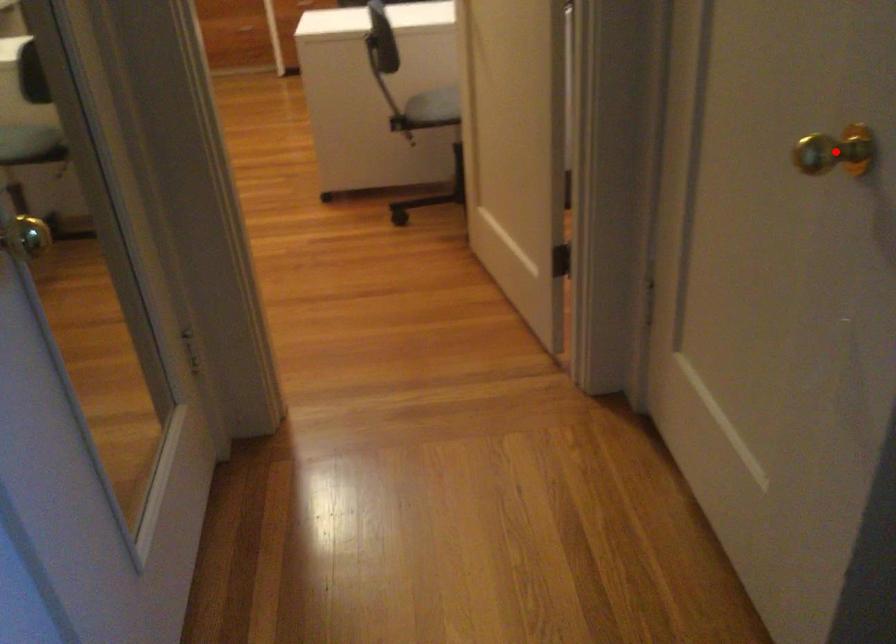
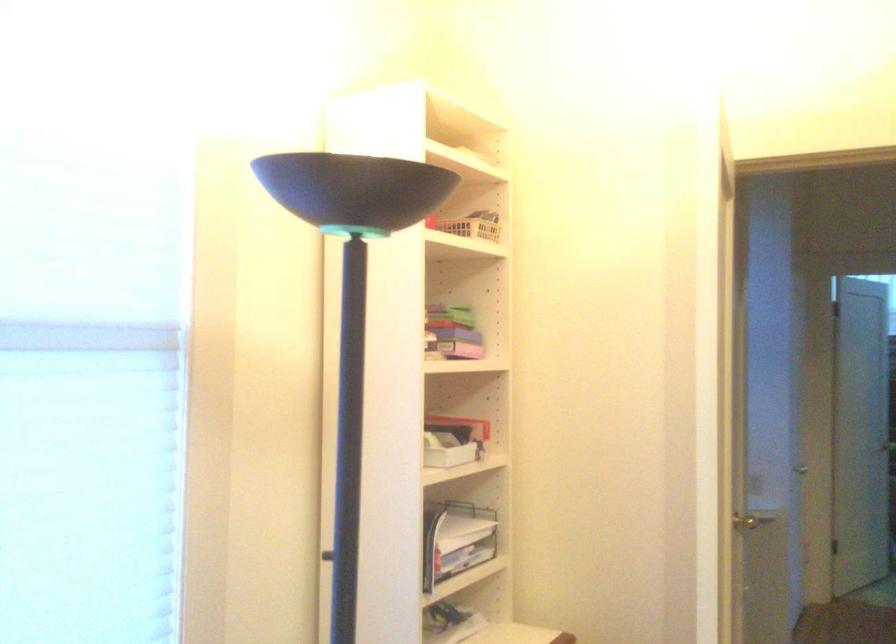
Question: I am providing you with two images of the same scene from different viewpoints. A red point is marked on the first image. Is the red point's position out of view in image 2?

Choices:
 (A) Yes
 (B) No

Answer: (A)